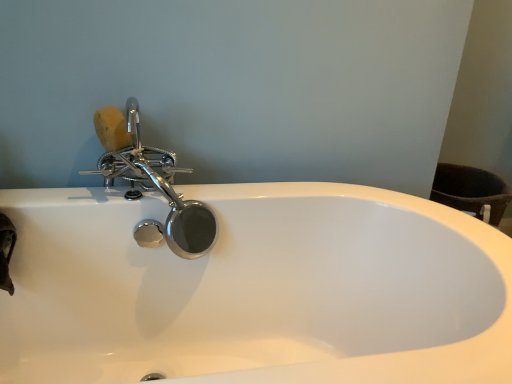
Question: From the image's perspective, is polished chrome faucet at upper left located above or below natural sponge at upper left?

Choices:
 (A) below
 (B) above

Answer: (A)

Question: Is polished chrome faucet at upper left in front of or behind natural sponge at upper left in the image?

Choices:
 (A) behind
 (B) front

Answer: (B)

Question: Based on their positions, is polished chrome faucet at upper left located to the left or right of natural sponge at upper left?

Choices:
 (A) left
 (B) right

Answer: (B)

Question: Considering the positions of natural sponge at upper left and polished chrome faucet at upper left in the image, is natural sponge at upper left taller or shorter than polished chrome faucet at upper left?

Choices:
 (A) tall
 (B) short

Answer: (B)

Question: Considering the positions of point (103, 117) and point (138, 225), is point (103, 117) closer or farther from the camera than point (138, 225)?

Choices:
 (A) closer
 (B) farther

Answer: (A)

Question: Which is correct: natural sponge at upper left is inside polished chrome faucet at upper left, or outside of it?

Choices:
 (A) inside
 (B) outside

Answer: (A)

Question: Considering the positions of natural sponge at upper left and polished chrome faucet at upper left in the image, is natural sponge at upper left wider or thinner than polished chrome faucet at upper left?

Choices:
 (A) thin
 (B) wide

Answer: (A)